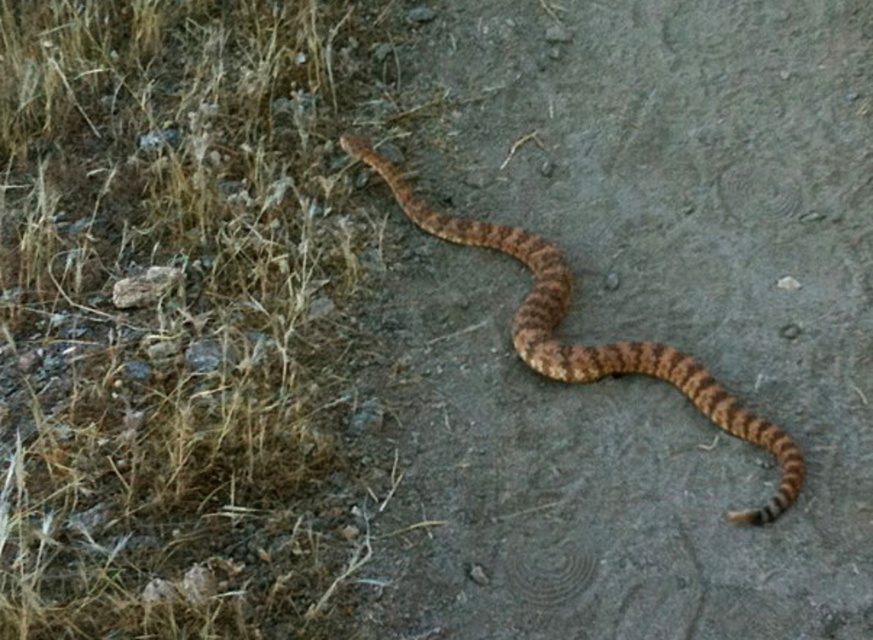
Question: Is brown dry grass at upper left closer to camera compared to brown scaly snake at center?

Choices:
 (A) no
 (B) yes

Answer: (B)

Question: Which of the following is the closest to the observer?

Choices:
 (A) brown dry grass at upper left
 (B) brown scaly snake at center

Answer: (A)

Question: Is brown dry grass at upper left below brown scaly snake at center?

Choices:
 (A) no
 (B) yes

Answer: (A)

Question: Is brown dry grass at upper left to the right of brown scaly snake at center from the viewer's perspective?

Choices:
 (A) no
 (B) yes

Answer: (A)